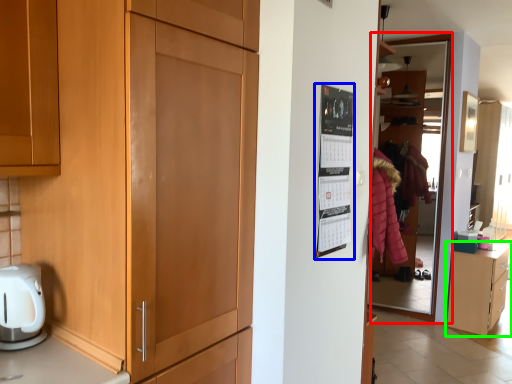
Question: Estimate the real-world distances between objects in this image. Which object is closer to glass door (highlighted by a red box), bulletin board (highlighted by a blue box) or cabinetry (highlighted by a green box)?

Choices:
 (A) bulletin board
 (B) cabinetry

Answer: (B)